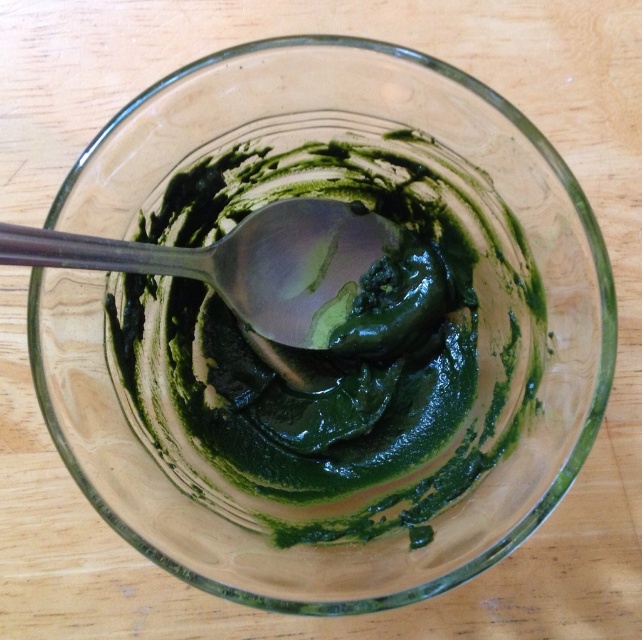
You are a chef preparing a dish and need to determine if the metallic silver spoon at center can be fully submerged in the green matte paste at center. Based on the provided scene, can you confirm if this is possible?

The green matte paste at center is much taller than the metallic silver spoon at center, so yes, the spoon can be fully submerged in the paste.

You are trying to determine the visibility of the metallic silver spoon at center in the glass bowl. Given that the green matte paste at center is in front of it, can you see the spoon clearly through the paste?

The metallic silver spoon at center is behind the green matte paste at center, so it might be partially obscured or less visible through the paste.

From the picture: You are trying to place a decorative sticker on the rim of the glass bowl. The sticker needs to be positioned exactly where the green matte paste at center is located. Is the sticker placement feasible given the position of the paste?

The green matte paste at center is located at point (345, 372), which is at the center of the bowl. Since the rim of the bowl is at the edge, the sticker cannot be placed at the center where the paste is located and still be on the rim. Therefore, the sticker placement is not feasible.